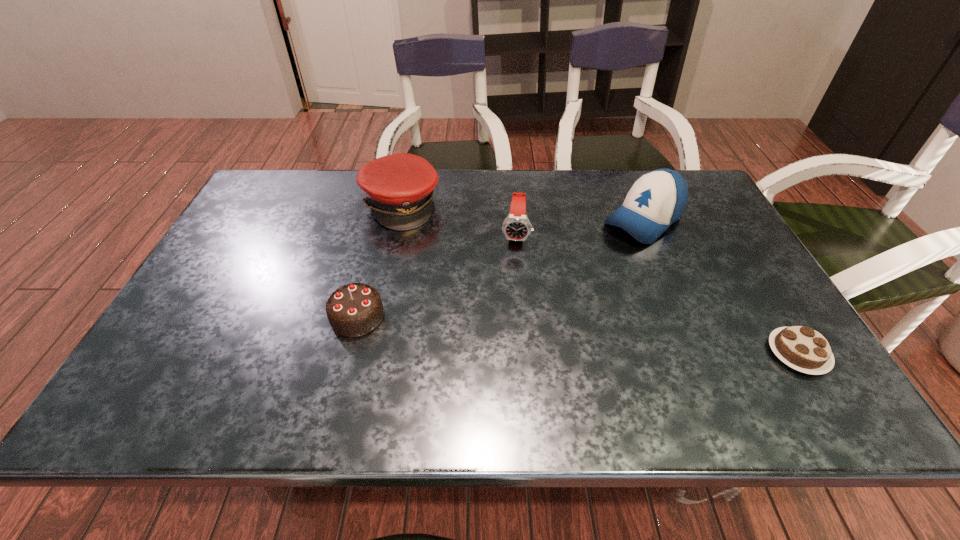
Identify the location of object that ranks as the closest to the watch. Image resolution: width=960 pixels, height=540 pixels. (399, 188).

I want to click on vacant region that satisfies the following two spatial constraints: 1. on the back side of the third object from right to left; 2. on the right side of the fourth object from left to right, so (515, 220).